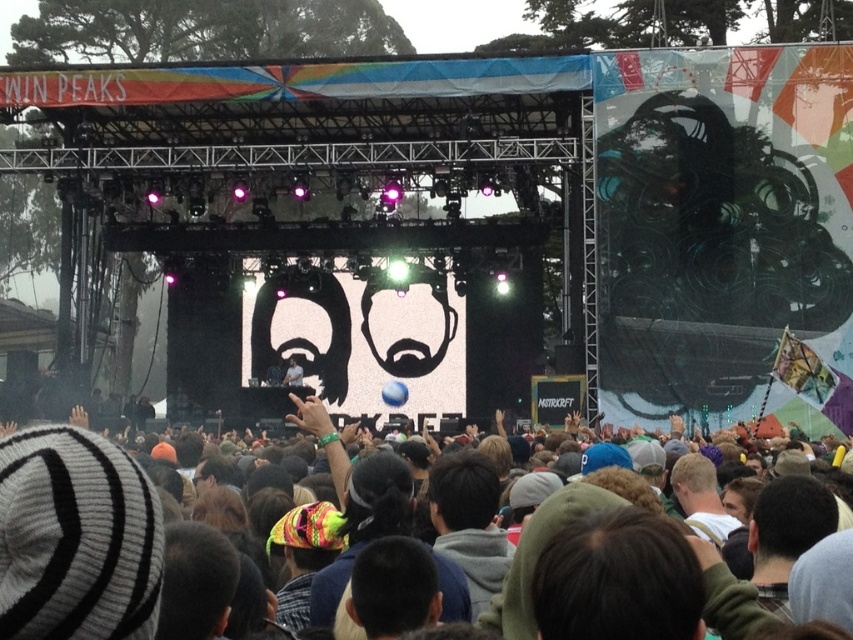
Question: Can you confirm if black matte face at center is positioned below matte yellow sunglasses at center?

Choices:
 (A) no
 (B) yes

Answer: (A)

Question: Can you confirm if black matte face at center is wider than multicolored fabric crowd at center?

Choices:
 (A) yes
 (B) no

Answer: (B)

Question: Which point is closer to the camera?

Choices:
 (A) multicolored fabric crowd at center
 (B) smooth skin face at upper center

Answer: (A)

Question: Which of the following is the farthest from the observer?

Choices:
 (A) multicolored fabric crowd at center
 (B) smooth skin face at upper center
 (C) black matte face at center
 (D) matte yellow sunglasses at center

Answer: (C)

Question: Which of these objects is positioned closest to the multicolored fabric crowd at center?

Choices:
 (A) smooth skin face at upper center
 (B) black matte face at center

Answer: (A)

Question: Is black matte face at center wider than smooth skin face at upper center?

Choices:
 (A) yes
 (B) no

Answer: (A)